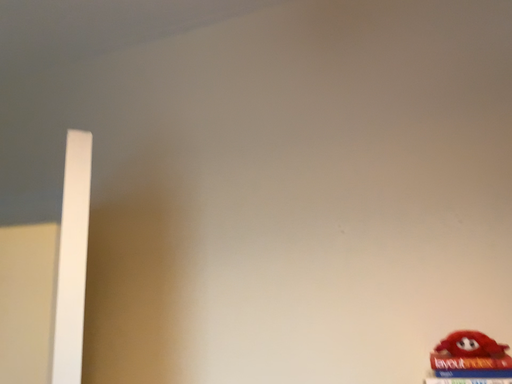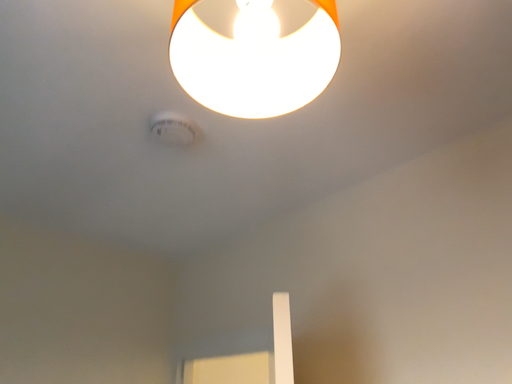
Question: Which way did the camera rotate in the video?

Choices:
 (A) rotated downward
 (B) rotated upward

Answer: (B)